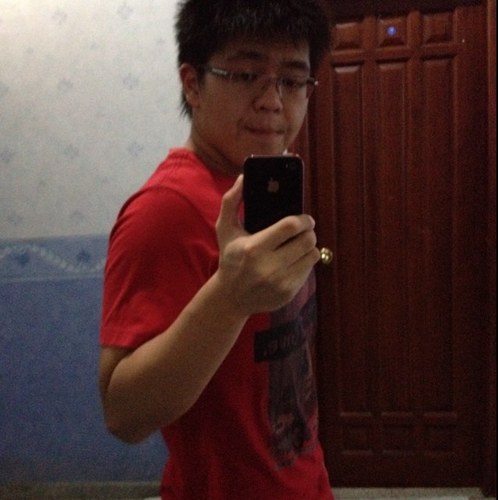
At what (x,y) coordinates should I click in order to perform the action: click on phone. Please return your answer as a coordinate pair (x, y). Looking at the image, I should click on (267, 197).